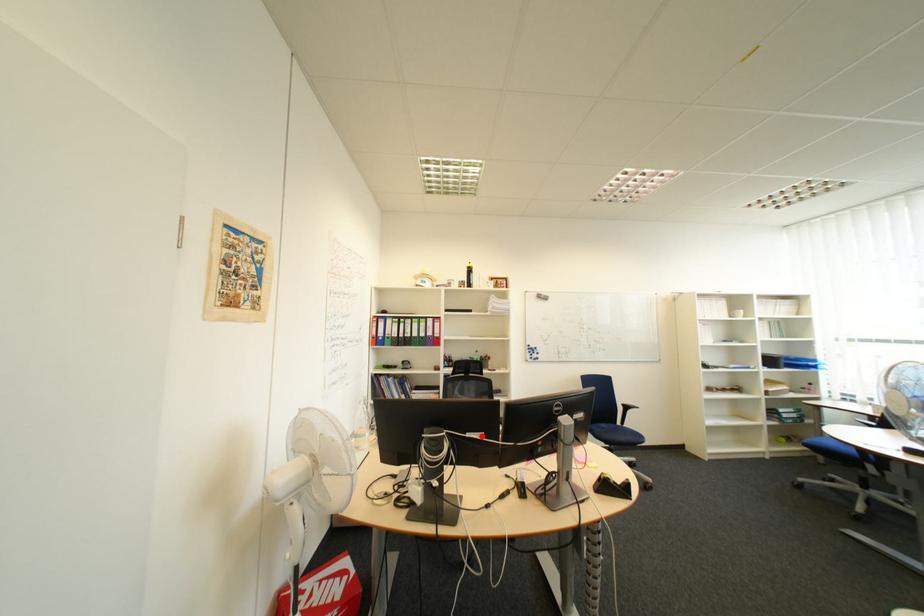
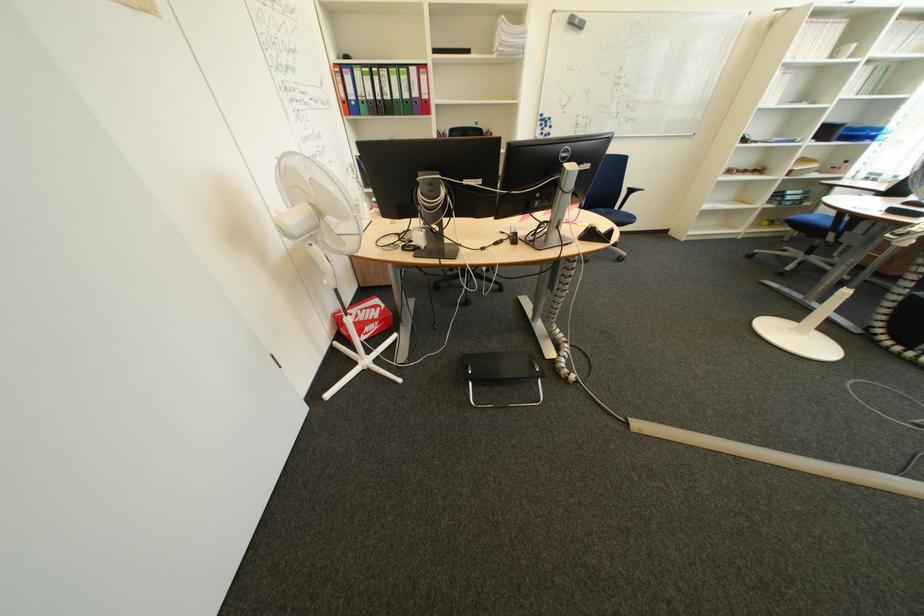
Locate, in the second image, the point that corresponds to the highlighted location in the first image.

(479, 184)